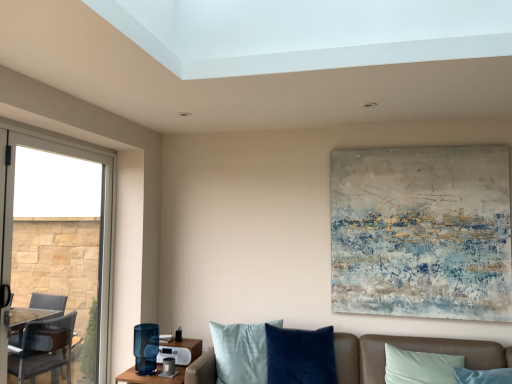
Question: From a real-world perspective, is clear glass window at left positioned above or below textured canvas painting at upper center?

Choices:
 (A) below
 (B) above

Answer: (A)

Question: From the image's perspective, relative to textured canvas painting at upper center, is clear glass window at left above or below?

Choices:
 (A) below
 (B) above

Answer: (A)

Question: Which object is positioned farthest from the velvet brown couch at lower center?

Choices:
 (A) matte blue glass at lower center
 (B) clear glass window at left
 (C) leather couch at lower right
 (D) textured canvas painting at upper center

Answer: (B)

Question: Estimate the real-world distances between objects in this image. Which object is closer to the leather couch at lower right?

Choices:
 (A) velvet brown couch at lower center
 (B) clear glass window at left
 (C) textured canvas painting at upper center
 (D) matte blue glass at lower center

Answer: (A)